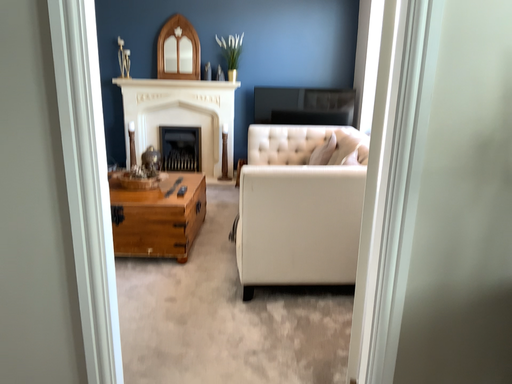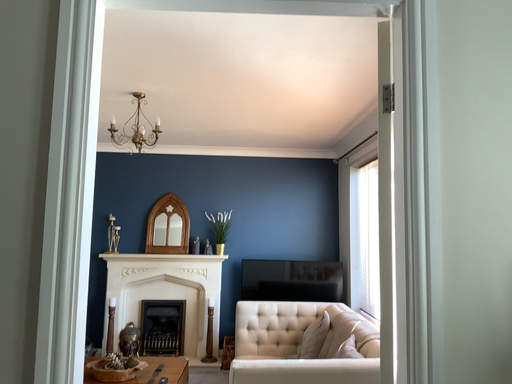
Question: Which way did the camera rotate in the video?

Choices:
 (A) rotated upward
 (B) rotated downward

Answer: (A)